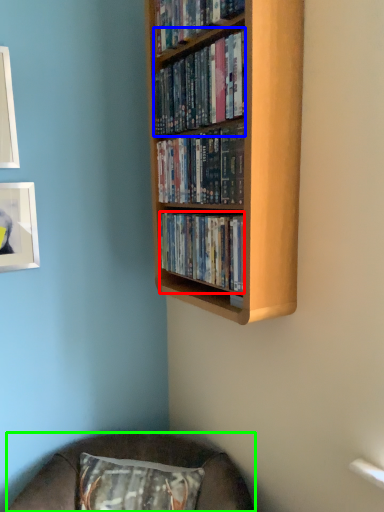
Question: Estimate the real-world distances between objects in this image. Which object is closer to book (highlighted by a red box), book (highlighted by a blue box) or furniture (highlighted by a green box)?

Choices:
 (A) book
 (B) furniture

Answer: (A)